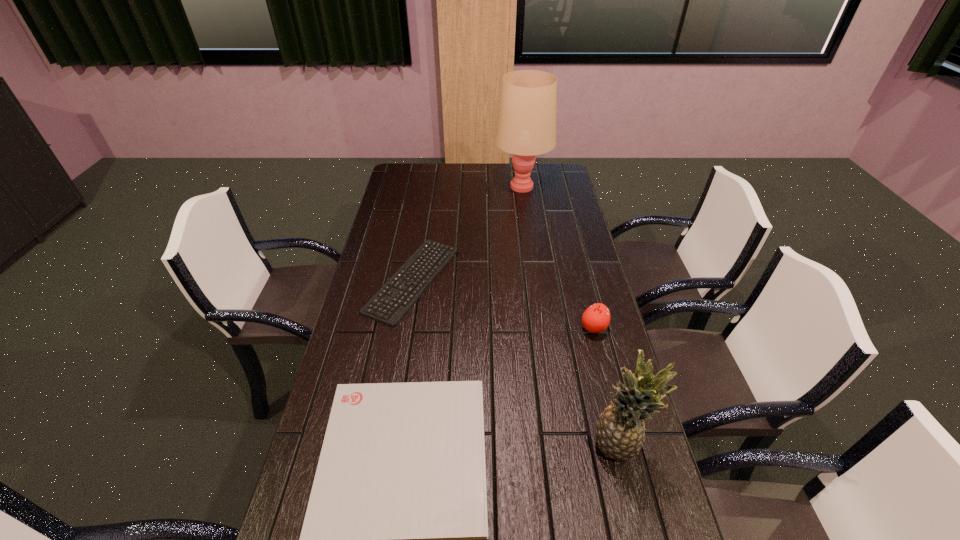
Find the location of a particular element. This screenshot has width=960, height=540. the tallest object is located at coordinates (526, 126).

Where is `the farthest object`? The image size is (960, 540). the farthest object is located at coordinates (526, 126).

You are a GUI agent. You are given a task and a screenshot of the screen. Output one action in this format:
    pyautogui.click(x=<x>, y=<y>)
    Task: Click on the pineapple
    
    Given the screenshot: What is the action you would take?
    pyautogui.click(x=620, y=429)

I want to click on the third tallest object, so click(x=596, y=318).

Identify the location of the shortest object. The width and height of the screenshot is (960, 540). (393, 295).

Where is `free region located on the front of the lampshade`? The height and width of the screenshot is (540, 960). free region located on the front of the lampshade is located at coordinates (526, 213).

Identify the location of vacant region located on the left of the fourth shortest object. This screenshot has height=540, width=960. (464, 447).

I want to click on blank area located 0.290m on the left of the apple, so click(x=488, y=328).

What are the coordinates of `vacant region located on the right of the computer keyboard` in the screenshot? It's located at (510, 280).

Identify the location of object at the far edge. (526, 126).